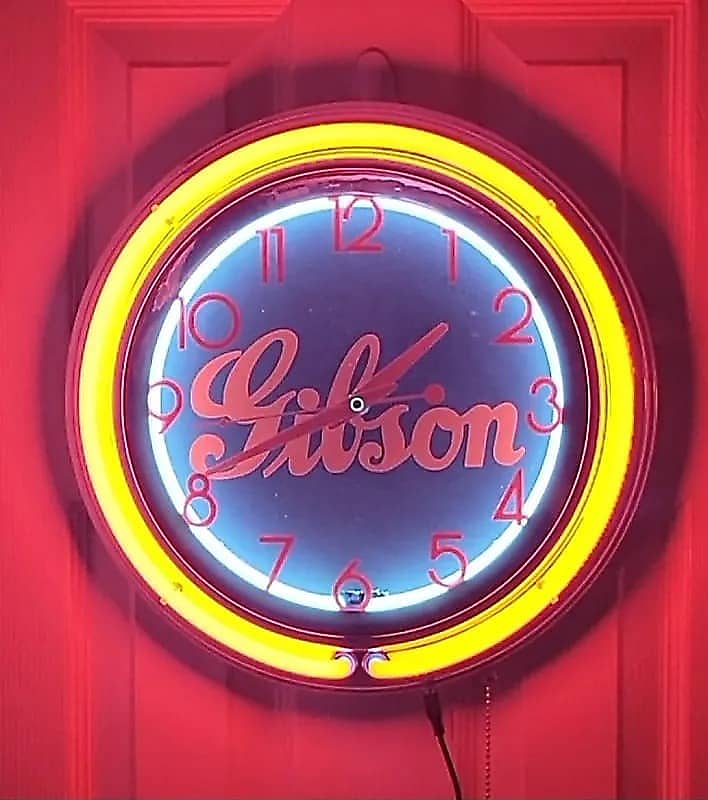
Identify the location of black cable. (433, 710).